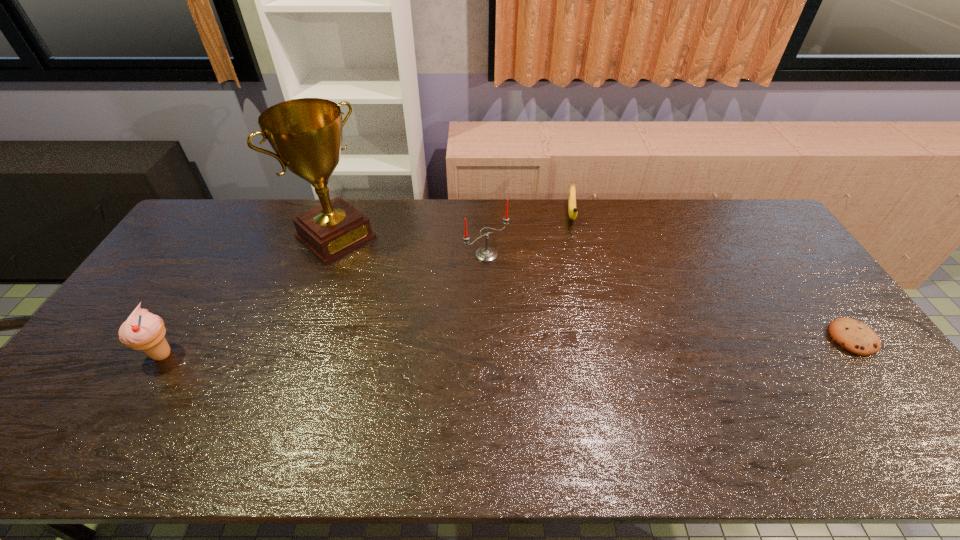
Locate an element on the screen. This screenshot has height=540, width=960. vacant space that's between the third object from right to left and the shortest object is located at coordinates (669, 296).

Identify the location of free space between the award and the leftmost object. The width and height of the screenshot is (960, 540). (249, 296).

In order to click on free space between the banana and the candle in this screenshot , I will do `click(529, 234)`.

Identify the location of unoccupied area between the leftmost object and the cookie. The height and width of the screenshot is (540, 960). (507, 346).

The image size is (960, 540). Find the location of `empty space between the icecream and the banana`. empty space between the icecream and the banana is located at coordinates (367, 285).

Locate an element on the screen. vacant space in between the tallest object and the candle is located at coordinates (411, 246).

Find the location of a particular element. object that is the second closest to the fourth object from right to left is located at coordinates (143, 330).

Where is `object that ranks as the second closest to the fourth object from left to right`? The image size is (960, 540). object that ranks as the second closest to the fourth object from left to right is located at coordinates (306, 134).

What are the coordinates of `blank space that satisfies the following two spatial constraints: 1. on the front side of the shortest object; 2. on the left side of the tallest object` in the screenshot? It's located at (300, 338).

This screenshot has width=960, height=540. Identify the location of free spot that satisfies the following two spatial constraints: 1. on the front side of the cookie; 2. on the right side of the tallest object. (300, 338).